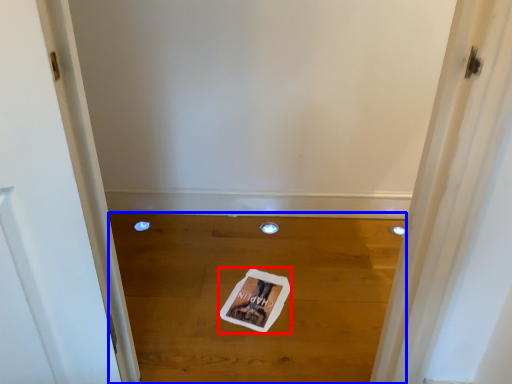
Question: Which object is closer to the camera taking this photo, magazine (highlighted by a red box) or plain (highlighted by a blue box)?

Choices:
 (A) magazine
 (B) plain

Answer: (B)